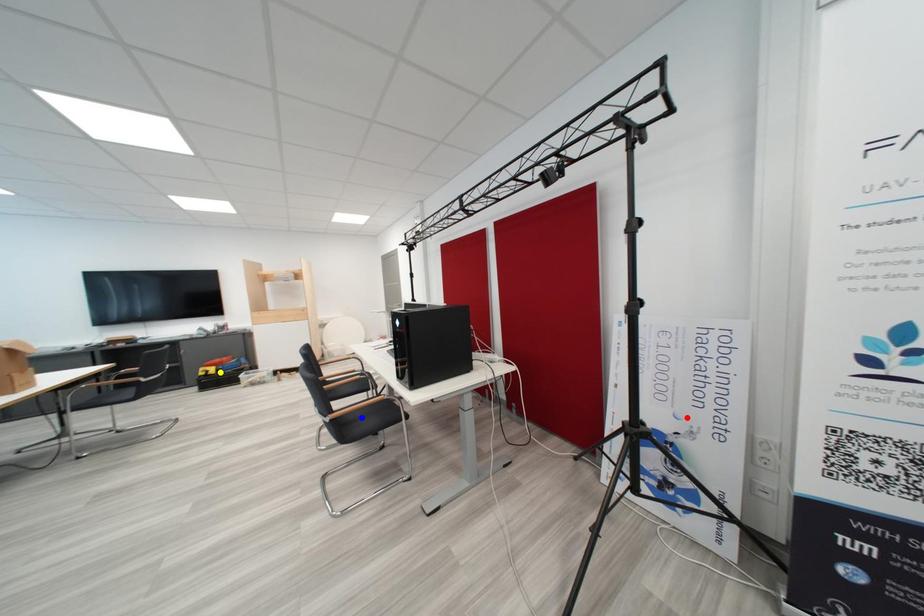
Order these from nearest to farthest:
A) red point
B) blue point
C) yellow point

red point → blue point → yellow point